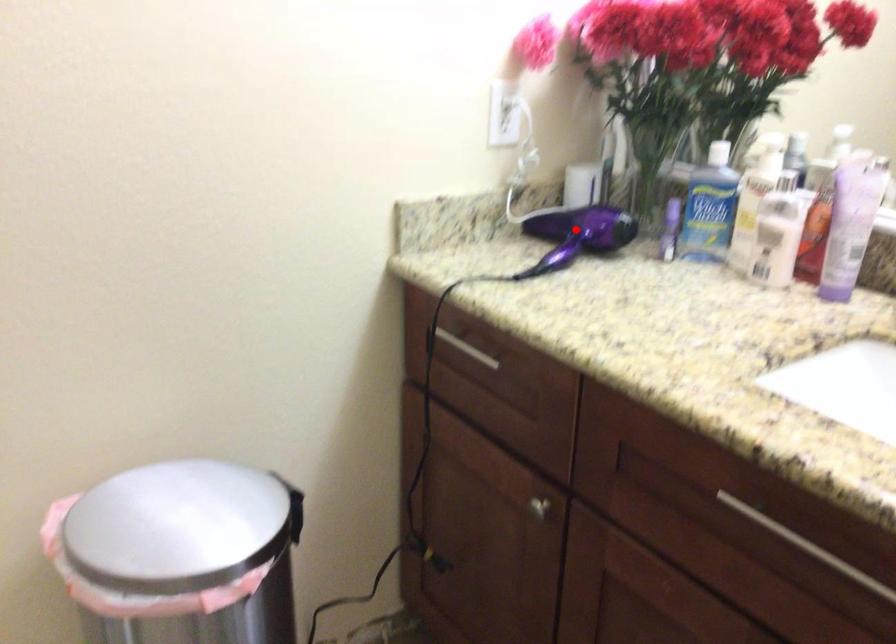
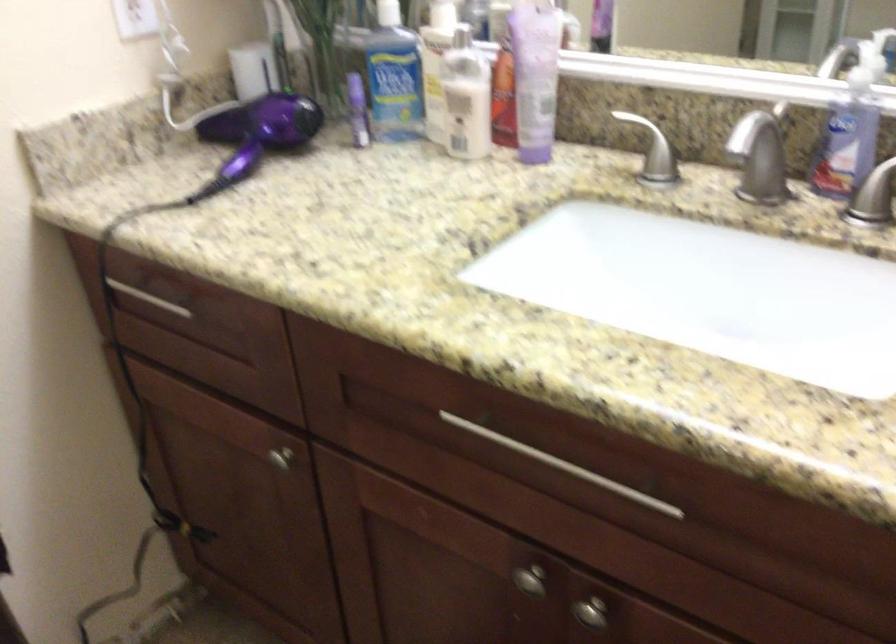
Where in the second image is the point corresponding to the highlighted location from the first image?

(256, 134)